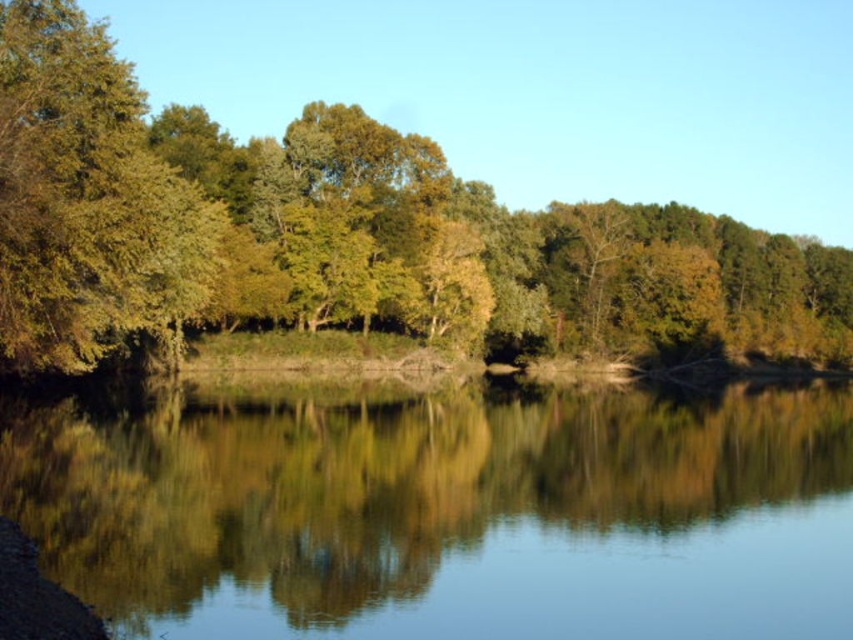
Is point (219, 577) positioned behind point (247, 300)?

That is False.

Is clear water at center behind green leafy trees at center?

That is False.

Is point (167, 532) farther from camera compared to point (817, 241)?

No, (167, 532) is in front of (817, 241).

The width and height of the screenshot is (853, 640). Find the location of `clear water at center`. clear water at center is located at coordinates (444, 509).